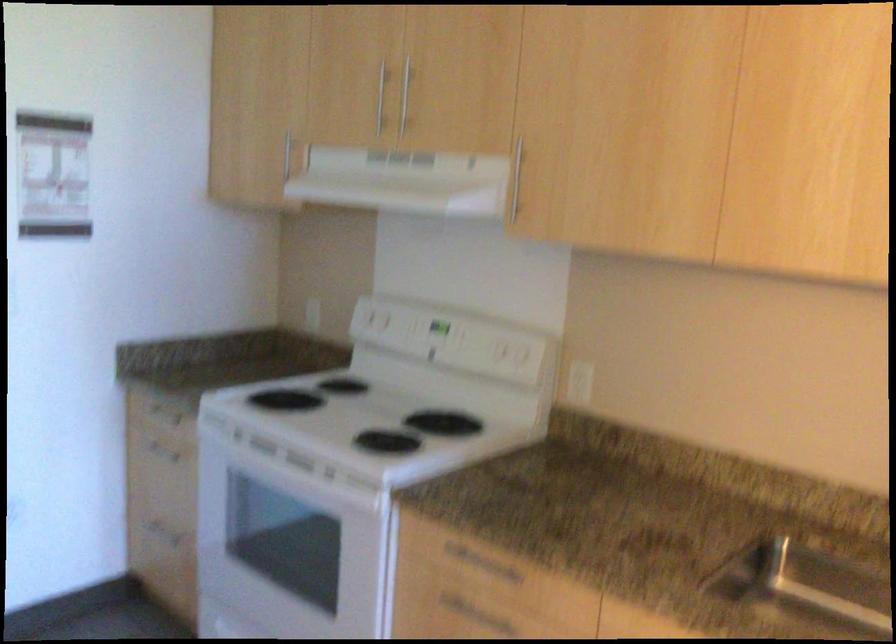
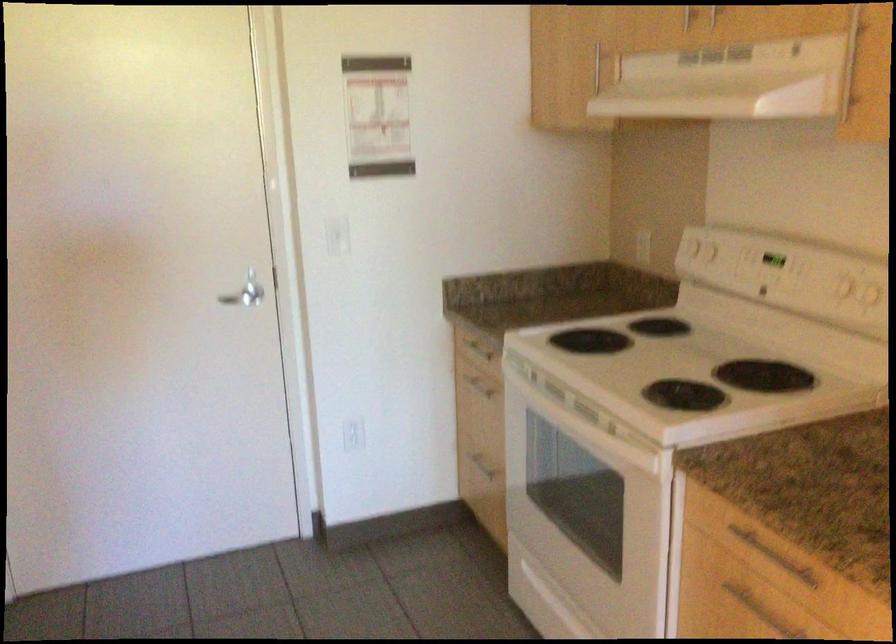
Locate, in the second image, the point that corresponds to point (395, 118) in the first image.

(714, 15)